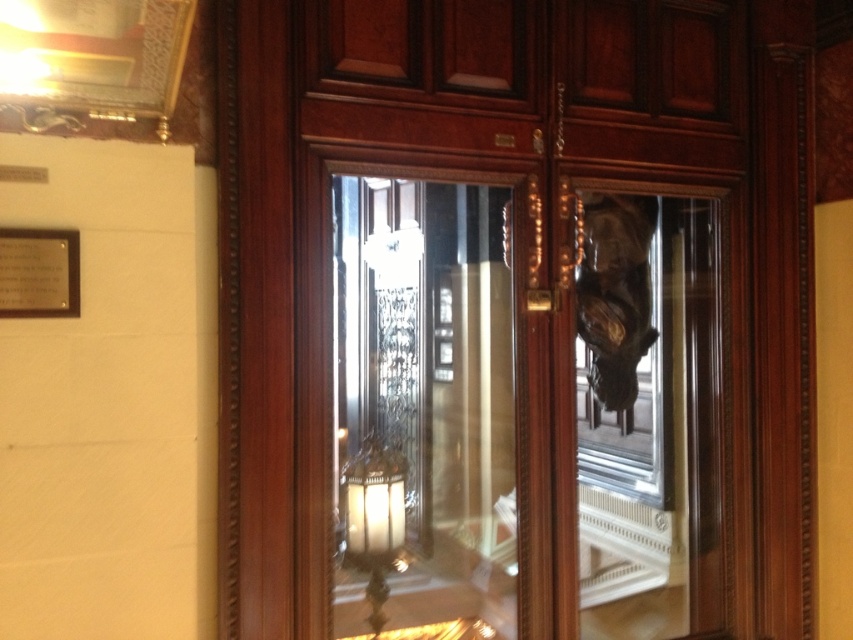
Is transparent glass door at center bigger than clear glass door at center?

Yes.

Between transparent glass door at center and clear glass door at center, which one is positioned higher?

Positioned higher is transparent glass door at center.

Locate an element on the screen. This screenshot has width=853, height=640. transparent glass door at center is located at coordinates (425, 406).